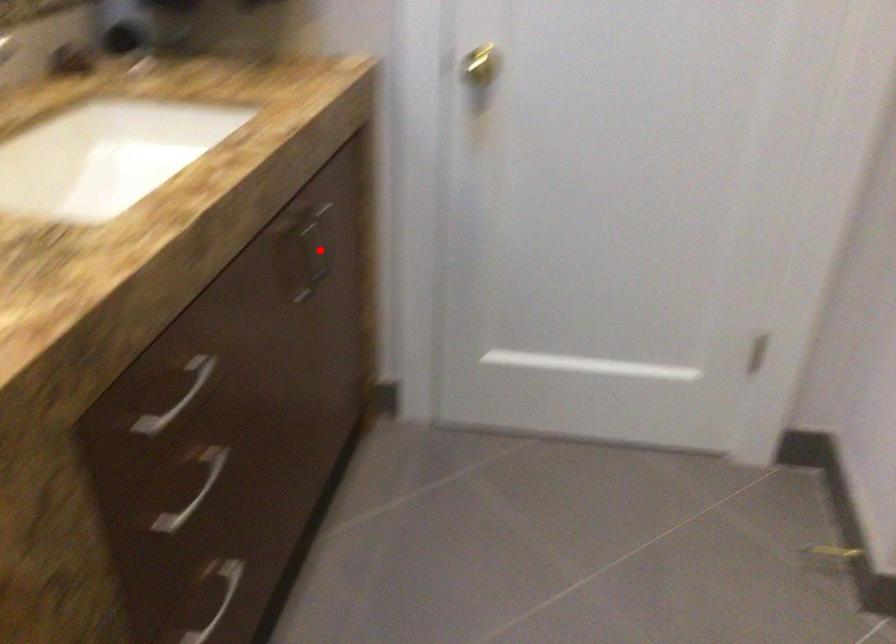
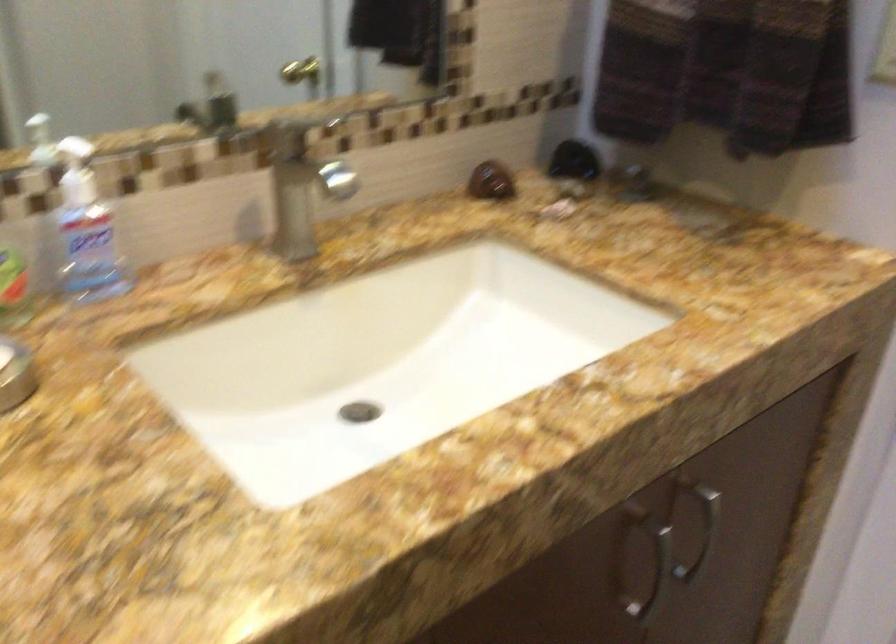
The point at the highlighted location is marked in the first image. Where is the corresponding point in the second image?

(702, 533)